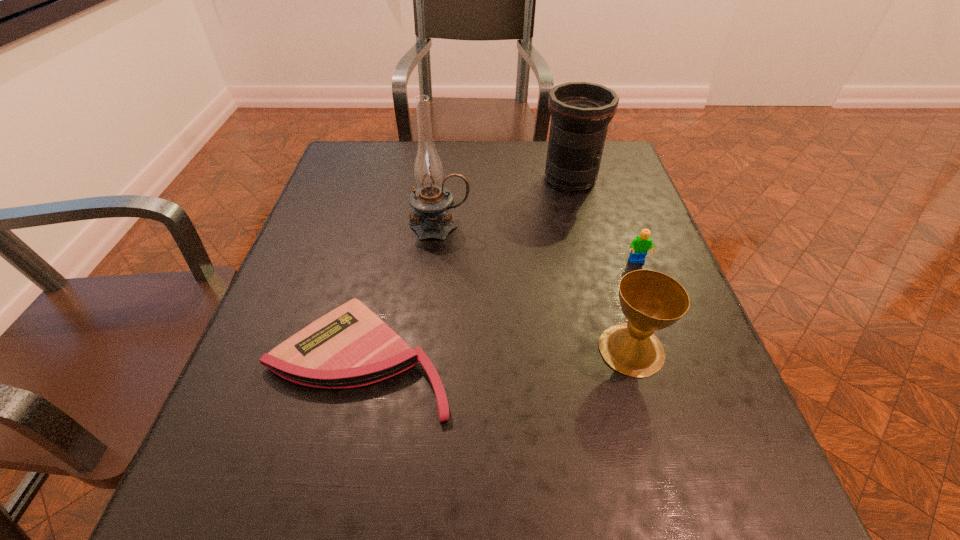
Image resolution: width=960 pixels, height=540 pixels. What are the coordinates of `oil lamp` in the screenshot? It's located at (430, 201).

This screenshot has height=540, width=960. In order to click on the tallest object in this screenshot , I will do `click(430, 201)`.

The width and height of the screenshot is (960, 540). What are the coordinates of `the second tallest object` in the screenshot? It's located at (580, 112).

Where is `the farthest object`? This screenshot has height=540, width=960. the farthest object is located at coordinates (580, 112).

Image resolution: width=960 pixels, height=540 pixels. What are the coordinates of `the third tallest object` in the screenshot? It's located at (650, 300).

At what (x,y) coordinates should I click in order to perform the action: click on the fourth tallest object. Please return your answer as a coordinate pair (x, y). Looking at the image, I should click on (641, 244).

You are a GUI agent. You are given a task and a screenshot of the screen. Output one action in this format:
    pyautogui.click(x=<x>, y=<y>)
    Task: Click on the Lego
    
    Given the screenshot: What is the action you would take?
    pyautogui.click(x=641, y=244)

The image size is (960, 540). I want to click on the shortest object, so click(x=350, y=346).

Find the location of a particular element. The image size is (960, 540). free spot located 0.060m on the left of the oil lamp is located at coordinates (383, 227).

Where is `vacant area located 0.100m on the front of the farthest object`? The image size is (960, 540). vacant area located 0.100m on the front of the farthest object is located at coordinates (582, 221).